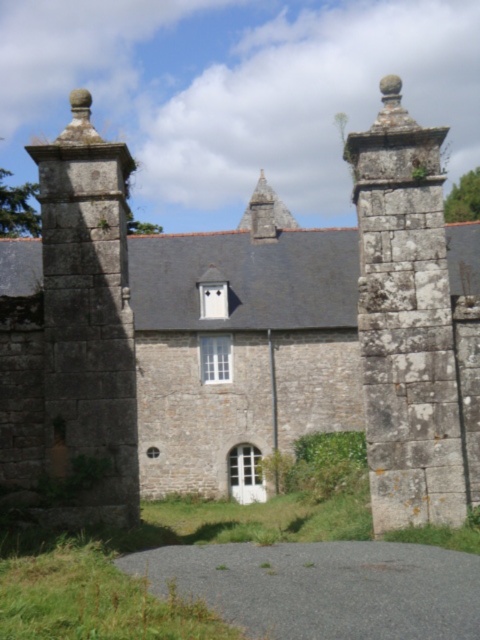
You are standing in front of the stone building and see a point marked at coordinates (407, 323). Based on the scene description, what object is located at this point?

The point at coordinates (407, 323) marks the rusty stone gatepost at right.

You are standing in front of the stone building and want to enter through the central arched doorway. Which object, the rusty stone gatepost at right or the rustic stone tower at left, is closer to the entrance?

The rusty stone gatepost at right is closer to the entrance because it is positioned over the rustic stone tower at left, indicating it is in front of the tower and thus nearer to the doorway.

You are a delivery driver with a truck that is 4 meters wide. You need to pass through the entrance between the rusty stone gatepost at right and the rustic stone tower at left. Can your truck fit through the entrance?

The distance between the rusty stone gatepost at right and the rustic stone tower at left is 4.66 meters, so the truck that is 4 meters wide can fit through the entrance since the entrance is wider than the truck.